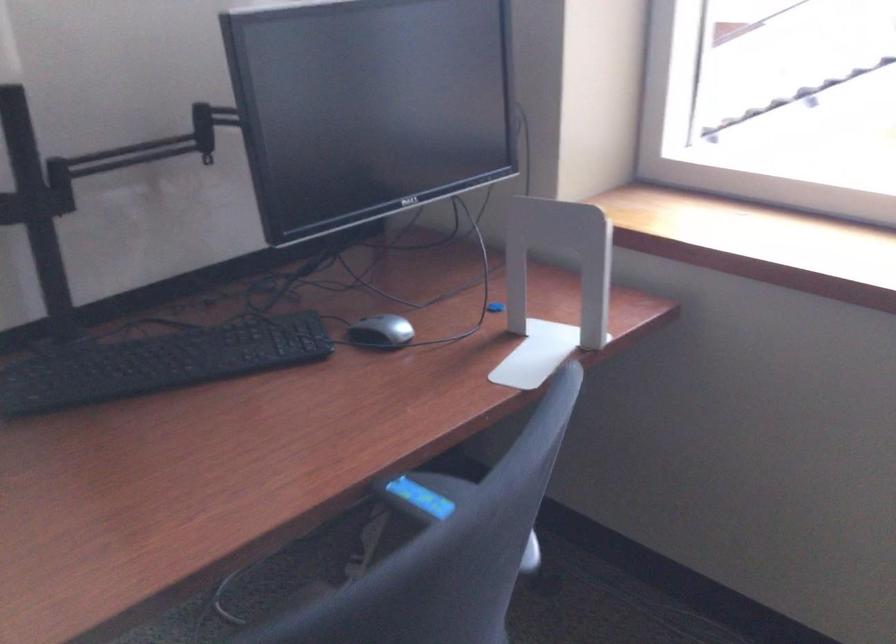
Describe the element at coordinates (425, 495) in the screenshot. I see `a blue chair lever` at that location.